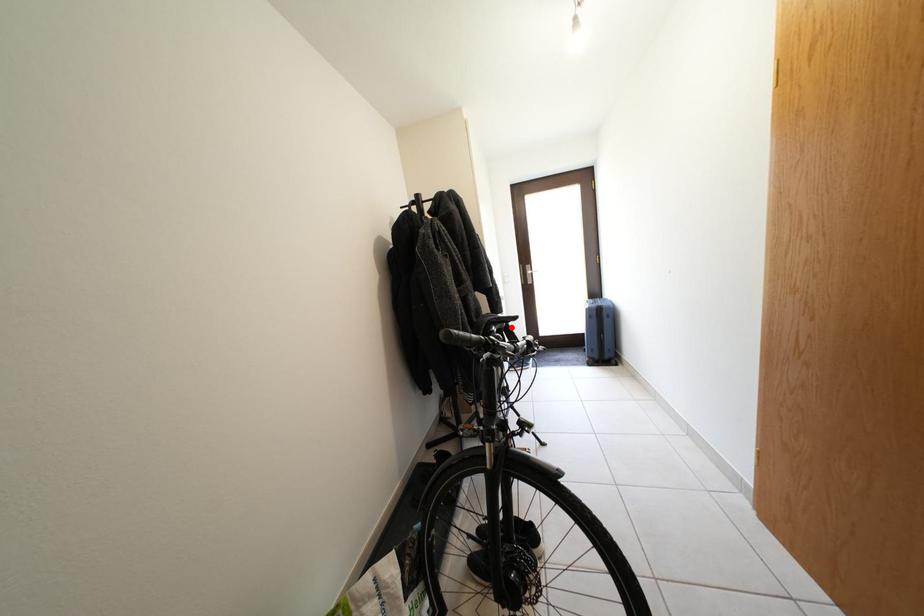
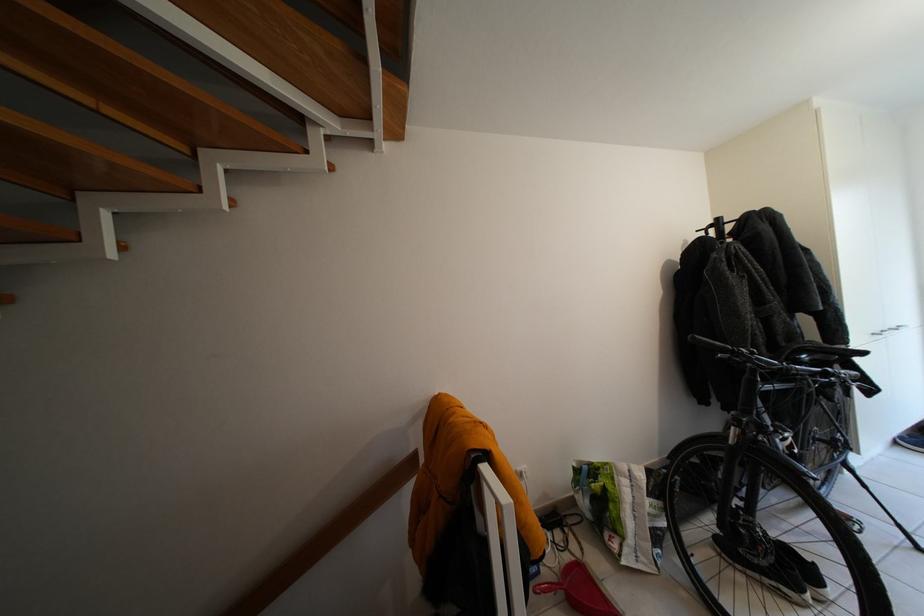
Question: A red point is marked in image1. In image2, is the corresponding 3D point closer to the camera or farther? Reply with the corresponding letter.

Choices:
 (A) The corresponding 3D point is closer.
 (B) The corresponding 3D point is farther.

Answer: (A)